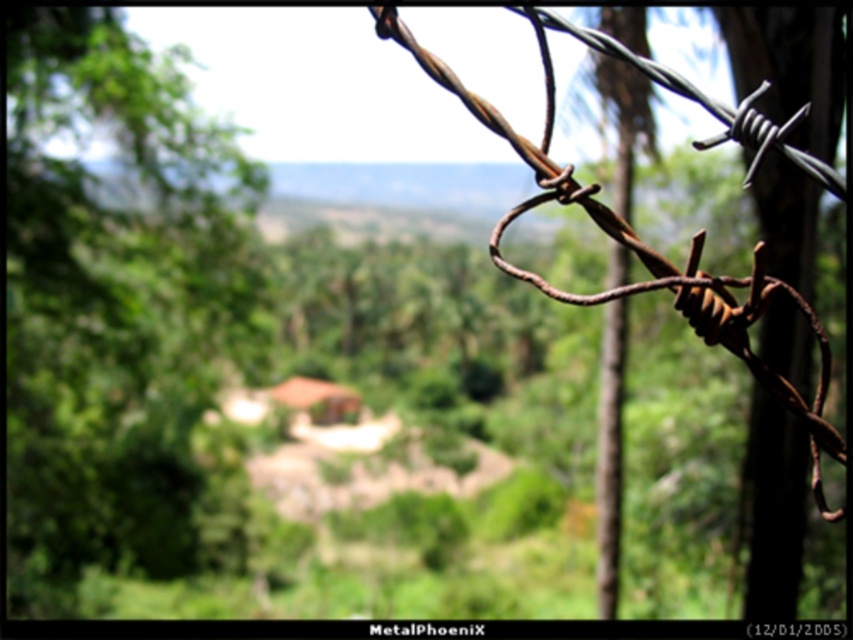
You are a bird looking for a place to perch. You see a green leafy tree at left and a rusty wire at right. Which location would provide a more stable perch?

The green leafy tree at left is positioned over rusty wire at right, so the green leafy tree at left would provide a more stable perch than the rusty wire at right.

You are a bird flying over the scene. You want to land on the green leafy tree at left or the rusty wire at right. Which one is taller?

The rusty wire at right is taller than the green leafy tree at left, so you should land on the rusty wire at right if you want to choose the taller one.